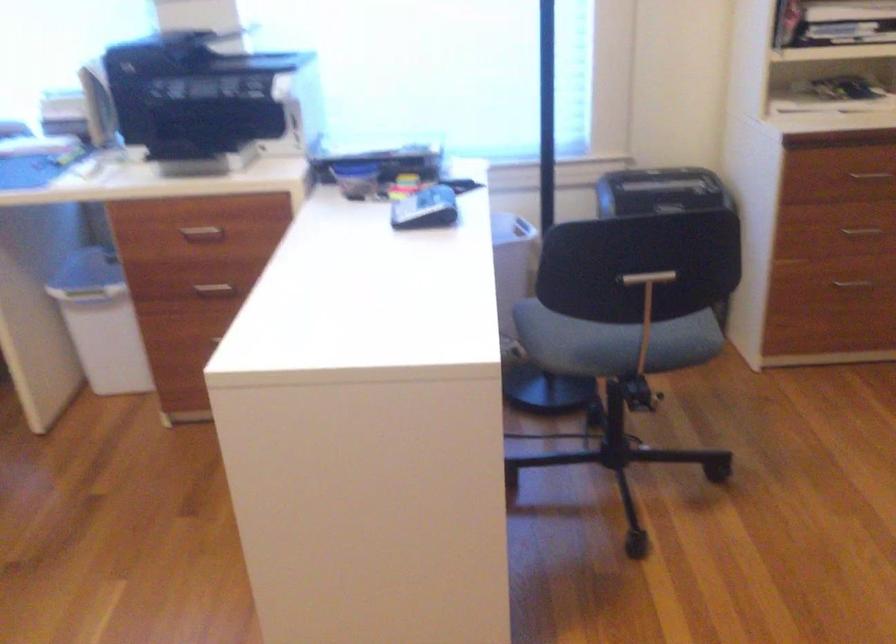
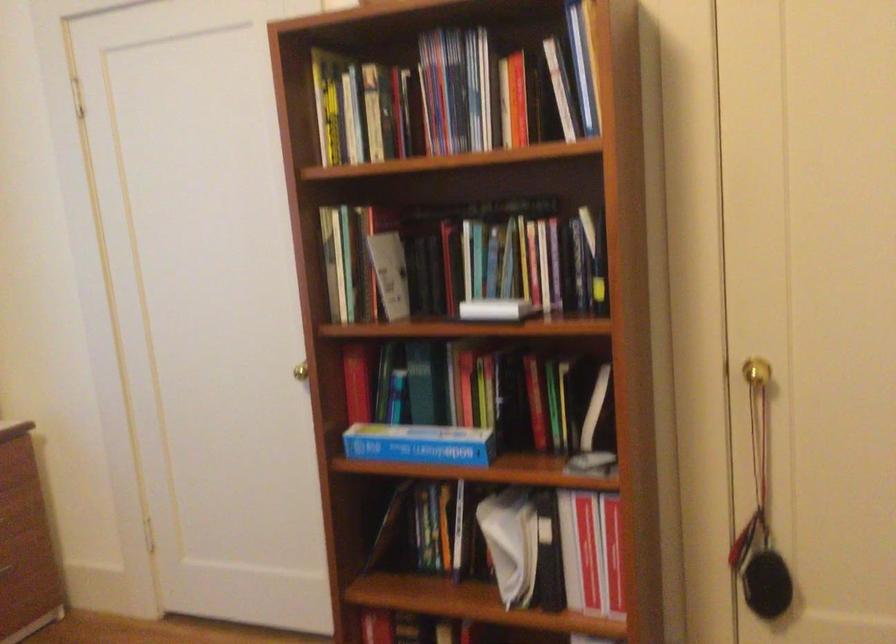
Question: Based on the continuous images, in which direction is the camera rotating? Reply with the corresponding letter.

Choices:
 (A) Left
 (B) Right
 (C) Up
 (D) Down

Answer: (B)